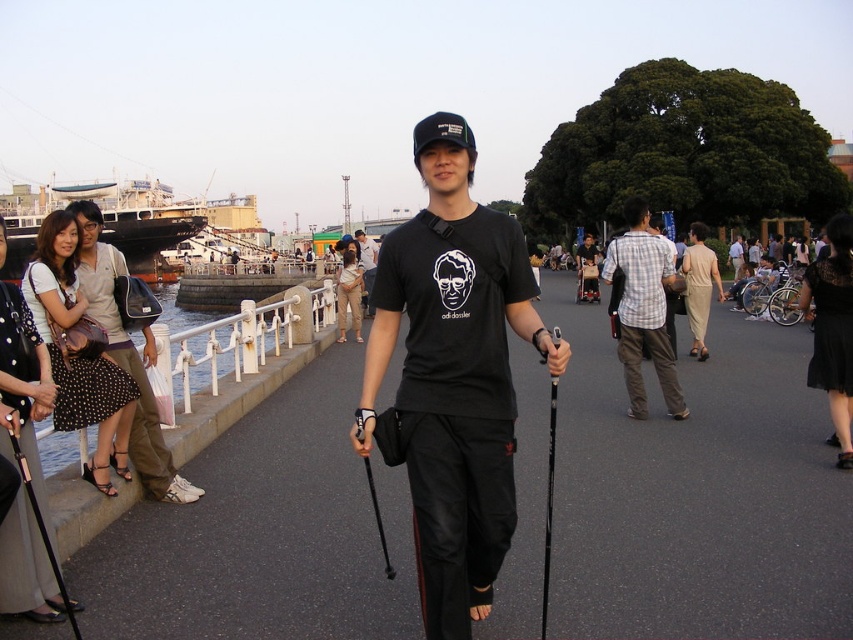
Question: Can you confirm if black matte t-shirt at center is positioned above black plastic ski pole at center?

Choices:
 (A) yes
 (B) no

Answer: (A)

Question: Does black matte t-shirt at center appear under black plastic ski pole at center?

Choices:
 (A) no
 (B) yes

Answer: (A)

Question: Among these objects, which one is nearest to the camera?

Choices:
 (A) black plastic ski pole at lower left
 (B) black plastic ski pole at center

Answer: (A)

Question: Is black matte t-shirt at center above matte black t-shirt at center?

Choices:
 (A) no
 (B) yes

Answer: (A)

Question: Which of the following is the farthest from the observer?

Choices:
 (A) (325, 460)
 (B) (50, 548)
 (C) (554, 404)

Answer: (C)

Question: Which of these objects is positioned closest to the black matte t-shirt at center?

Choices:
 (A) black fabric t-shirt at center
 (B) black plastic ski pole at center
 (C) plaid cotton shirt at center
 (D) black plastic ski pole at lower left

Answer: (B)